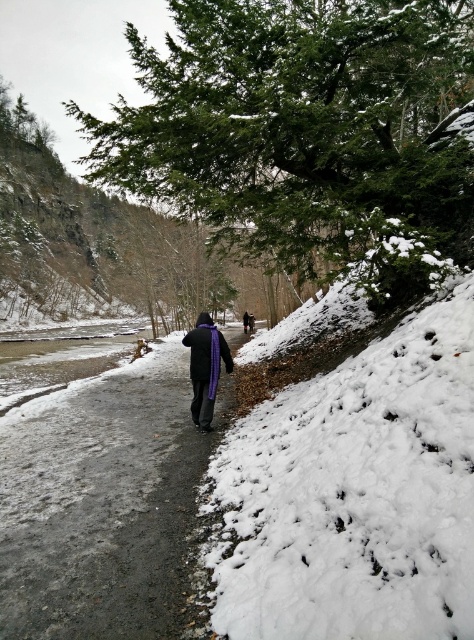
Is point (178, 432) farther from camera compared to point (210, 376)?

Yes, point (178, 432) is farther from viewer.

Is gray gravel path at center thinner than purple fleece sweatshirt at center?

No, gray gravel path at center is not thinner than purple fleece sweatshirt at center.

The height and width of the screenshot is (640, 474). What do you see at coordinates (100, 502) in the screenshot? I see `gray gravel path at center` at bounding box center [100, 502].

You are a GUI agent. You are given a task and a screenshot of the screen. Output one action in this format:
    pyautogui.click(x=<x>, y=<y>)
    Task: Click on the gray gravel path at center
    Image resolution: width=474 pixels, height=640 pixels.
    Given the screenshot: What is the action you would take?
    pyautogui.click(x=100, y=502)

Does green textured pine at upper center have a larger size compared to white fluffy snow at right?

Indeed, green textured pine at upper center has a larger size compared to white fluffy snow at right.

Which is in front, point (322, 77) or point (417, 464)?

Point (417, 464) is in front.

Find the location of a particular element. green textured pine at upper center is located at coordinates (299, 122).

Which is in front, point (344, 138) or point (199, 369)?

Point (344, 138) is in front.

From the picture: Is the position of green textured pine at upper center less distant than that of purple fleece sweatshirt at center?

That is True.

Is point (266, 230) farther from viewer compared to point (228, 364)?

That is False.

At what (x,y) coordinates should I click in order to perform the action: click on green textured pine at upper center. Please return your answer as a coordinate pair (x, y). Looking at the image, I should click on (299, 122).